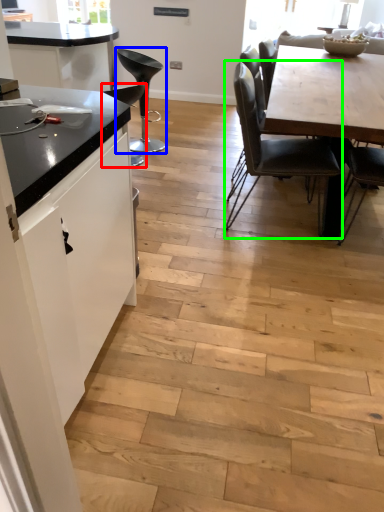
Question: Considering the real-world distances, which object is farthest from chair (highlighted by a red box)? chair (highlighted by a blue box) or chair (highlighted by a green box)?

Choices:
 (A) chair
 (B) chair

Answer: (B)